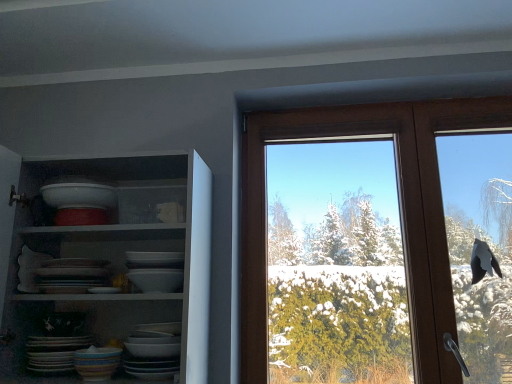
The image size is (512, 384). In order to click on vacant space situated above brown wooden window at upper right (from a real-world perspective) in this screenshot , I will do `click(375, 103)`.